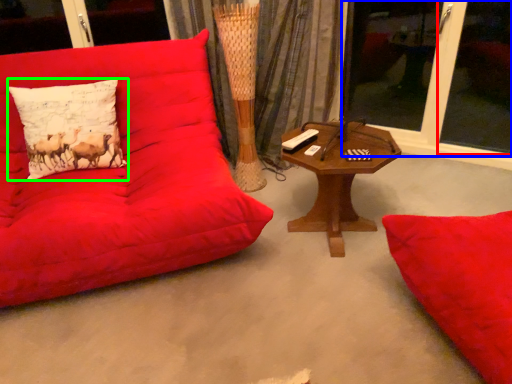
Question: Which object is positioned closest to window screen (highlighted by a red box)? Select from window screen (highlighted by a blue box) and pillow (highlighted by a green box).

Choices:
 (A) window screen
 (B) pillow

Answer: (A)